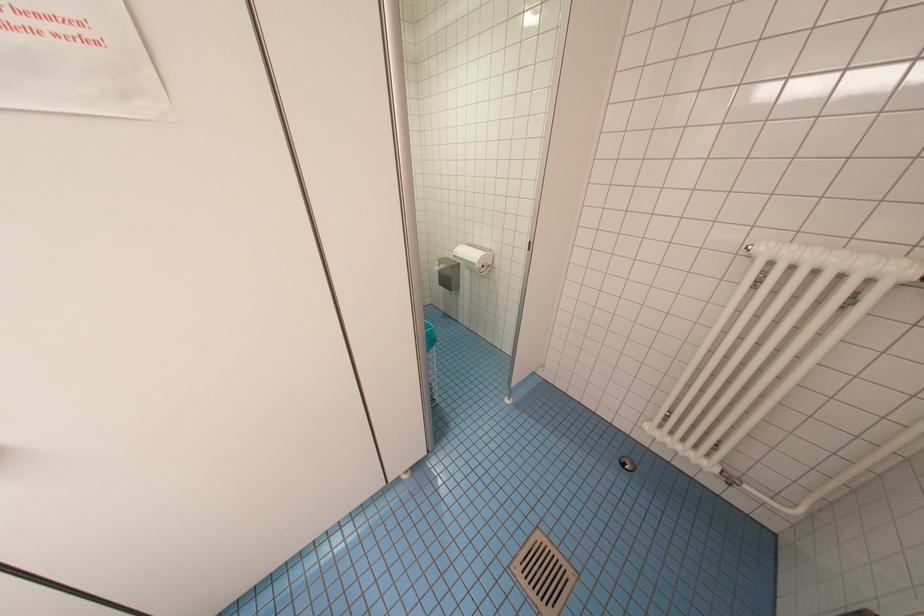
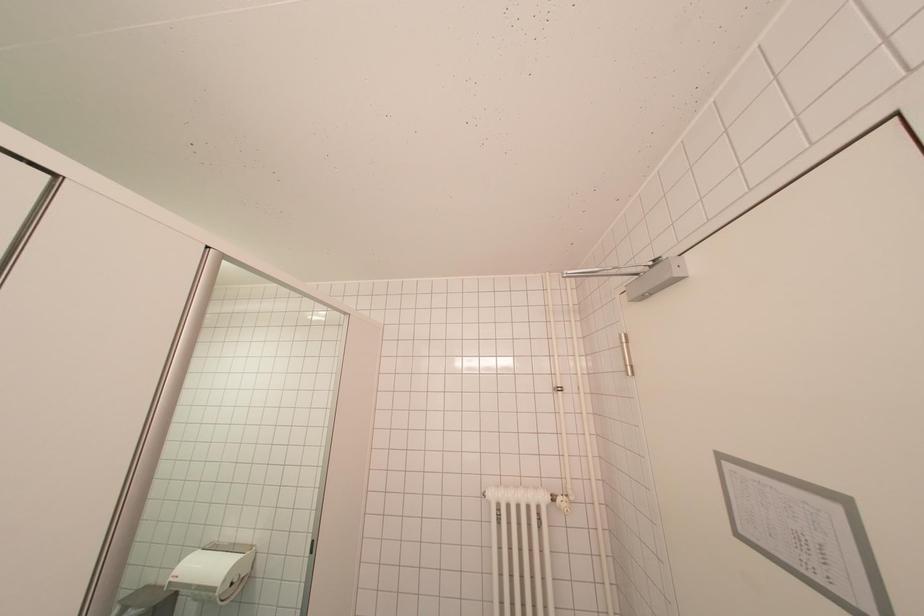
The first image is from the beginning of the video and the second image is from the end. How did the camera likely rotate when shooting the video?

The camera's rotation is toward right-up.